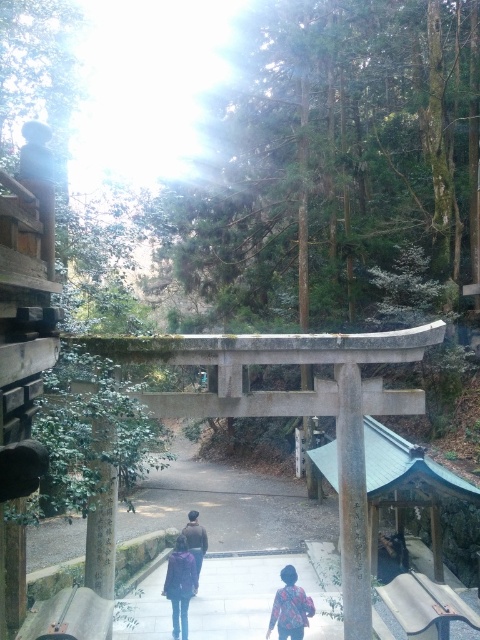
You are standing at the torii gate in the Japanese shrine scene. You notice two points marked on the path leading away from the gate. The first point is at coordinates point (x=178, y=632) and the second is at point (x=300, y=630). If you were to walk along the path, which point would you encounter first?

Point (x=300, y=630) would be encountered first because it is in front of point (x=178, y=632) along the path.